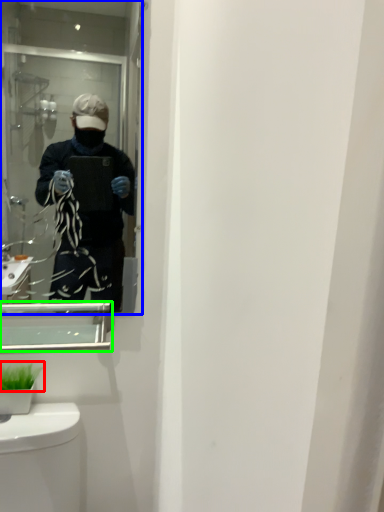
Question: Considering the real-world distances, which object is farthest from plant (highlighted by a red box)? mirror (highlighted by a blue box) or medicine cabinet (highlighted by a green box)?

Choices:
 (A) mirror
 (B) medicine cabinet

Answer: (A)